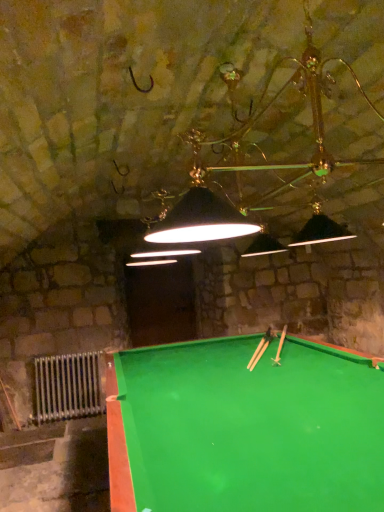
Identify the location of green felt billiard table at center. (245, 429).

The width and height of the screenshot is (384, 512). What do you see at coordinates (280, 346) in the screenshot? I see `green plastic cue at center, which ranks as the 1th cue in top-to-bottom order` at bounding box center [280, 346].

At what (x,y) coordinates should I click in order to perform the action: click on wooden cue at center, the second cue positioned from the top. Please return your answer as a coordinate pair (x, y). The height and width of the screenshot is (512, 384). Looking at the image, I should click on (260, 353).

From the image's perspective, between wooden cue at center, the second cue positioned from the top, and green felt billiard table at center, who is located below?

green felt billiard table at center is shown below in the image.

In the scene shown: Is wooden cue at center, the second cue positioned from the top, not near green felt billiard table at center?

wooden cue at center, the second cue positioned from the top, is near green felt billiard table at center, not far away.

Is wooden cue at center, the second cue positioned from the top, at the right side of green felt billiard table at center?

Indeed, wooden cue at center, the second cue positioned from the top, is positioned on the right side of green felt billiard table at center.

Find the location of a particular element. radiator below the green felt billiard table at center (from the image's perspective) is located at coordinates (68, 387).

Between silver metallic radiator at lower left and green felt billiard table at center, which one has smaller size?

Smaller between the two is silver metallic radiator at lower left.

Can you confirm if silver metallic radiator at lower left is wider than green felt billiard table at center?

In fact, silver metallic radiator at lower left might be narrower than green felt billiard table at center.

Is silver metallic radiator at lower left to the left or to the right of green felt billiard table at center in the image?

In the image, silver metallic radiator at lower left appears on the left side of green felt billiard table at center.

Are wooden cue at center, the second cue positioned from the top, and silver metallic radiator at lower left making contact?

They are not placed beside each other.

Is wooden cue at center, the second cue positioned from the top, turned away from silver metallic radiator at lower left?

No, wooden cue at center, the second cue positioned from the top,'s orientation is not away from silver metallic radiator at lower left.

From the image's perspective, is wooden cue at center, positioned as the first cue in bottom-to-top order, located beneath silver metallic radiator at lower left?

Actually, wooden cue at center, positioned as the first cue in bottom-to-top order, appears above silver metallic radiator at lower left in the image.

Which point is more distant from viewer, [251,367] or [61,370]?

The point [61,370] is farther from the camera.

From the image's perspective, which one is positioned lower, green plastic cue at center, which is counted as the 2th cue, starting from the bottom, or wooden cue at center, positioned as the first cue in bottom-to-top order?

wooden cue at center, positioned as the first cue in bottom-to-top order, from the image's perspective.

In terms of height, does green plastic cue at center, which ranks as the 1th cue in top-to-bottom order, look taller or shorter compared to wooden cue at center, positioned as the first cue in bottom-to-top order?

Considering their sizes, green plastic cue at center, which ranks as the 1th cue in top-to-bottom order, has more height than wooden cue at center, positioned as the first cue in bottom-to-top order.

Which object is positioned more to the left, green plastic cue at center, which ranks as the 1th cue in top-to-bottom order, or wooden cue at center, the second cue positioned from the top?

From the viewer's perspective, wooden cue at center, the second cue positioned from the top, appears more on the left side.

Can you confirm if green plastic cue at center, which ranks as the 1th cue in top-to-bottom order, is wider than green felt billiard table at center?

No.

Does green plastic cue at center, which is counted as the 2th cue, starting from the bottom, have a smaller size compared to green felt billiard table at center?

Yes, green plastic cue at center, which is counted as the 2th cue, starting from the bottom, is smaller than green felt billiard table at center.

Which is closer, (280, 349) or (204, 373)?

The point (204, 373) is closer.

From the image's perspective, does green plastic cue at center, which ranks as the 1th cue in top-to-bottom order, appear lower than green felt billiard table at center?

No, from the image's perspective, green plastic cue at center, which ranks as the 1th cue in top-to-bottom order, is not below green felt billiard table at center.

Considering the relative sizes of wooden cue at center, positioned as the first cue in bottom-to-top order, and green plastic cue at center, which is counted as the 2th cue, starting from the bottom, in the image provided, is wooden cue at center, positioned as the first cue in bottom-to-top order, smaller than green plastic cue at center, which is counted as the 2th cue, starting from the bottom,?

Correct, wooden cue at center, positioned as the first cue in bottom-to-top order, occupies less space than green plastic cue at center, which is counted as the 2th cue, starting from the bottom.

From the image's perspective, which one is positioned lower, wooden cue at center, positioned as the first cue in bottom-to-top order, or green plastic cue at center, which is counted as the 2th cue, starting from the bottom?

wooden cue at center, positioned as the first cue in bottom-to-top order.

Could you measure the distance between wooden cue at center, the second cue positioned from the top, and green plastic cue at center, which is counted as the 2th cue, starting from the bottom?

wooden cue at center, the second cue positioned from the top, and green plastic cue at center, which is counted as the 2th cue, starting from the bottom, are 6.86 inches apart.

Is wooden cue at center, positioned as the first cue in bottom-to-top order, in contact with green plastic cue at center, which is counted as the 2th cue, starting from the bottom?

No.

Is green felt billiard table at center further to camera compared to silver metallic radiator at lower left?

That is False.

Is green felt billiard table at center spatially inside silver metallic radiator at lower left, or outside of it?

green felt billiard table at center is spatially situated outside silver metallic radiator at lower left.

Is green felt billiard table at center taller or shorter than silver metallic radiator at lower left?

In the image, green felt billiard table at center appears to be taller than silver metallic radiator at lower left.

From a real-world perspective, who is located higher, green felt billiard table at center or silver metallic radiator at lower left?

From a 3D spatial view, green felt billiard table at center is above.

In order to click on billiard table on the left of wooden cue at center, positioned as the first cue in bottom-to-top order in this screenshot , I will do `click(245, 429)`.

Identify the location of billiard table above the silver metallic radiator at lower left (from a real-world perspective). (245, 429).

From the image, which object appears to be nearer to green felt billiard table at center, silver metallic radiator at lower left or green plastic cue at center, which is counted as the 2th cue, starting from the bottom?

green plastic cue at center, which is counted as the 2th cue, starting from the bottom, is positioned closer to the anchor green felt billiard table at center.

Considering their positions, is silver metallic radiator at lower left positioned closer to green plastic cue at center, which is counted as the 2th cue, starting from the bottom, than green felt billiard table at center?

Among the two, green felt billiard table at center is located nearer to green plastic cue at center, which is counted as the 2th cue, starting from the bottom.

Estimate the real-world distances between objects in this image. Which object is further from silver metallic radiator at lower left, wooden cue at center, positioned as the first cue in bottom-to-top order, or green felt billiard table at center?

Among the two, green felt billiard table at center is located further to silver metallic radiator at lower left.

Which object lies further to the anchor point green plastic cue at center, which ranks as the 1th cue in top-to-bottom order, green felt billiard table at center or wooden cue at center, the second cue positioned from the top?

green felt billiard table at center is positioned further to the anchor green plastic cue at center, which ranks as the 1th cue in top-to-bottom order.

When comparing their distances from silver metallic radiator at lower left, does green felt billiard table at center or wooden cue at center, the second cue positioned from the top, seem closer?

Based on the image, wooden cue at center, the second cue positioned from the top, appears to be nearer to silver metallic radiator at lower left.

Estimate the real-world distances between objects in this image. Which object is closer to wooden cue at center, the second cue positioned from the top, silver metallic radiator at lower left or green plastic cue at center, which is counted as the 2th cue, starting from the bottom?

green plastic cue at center, which is counted as the 2th cue, starting from the bottom.

Considering their positions, is green felt billiard table at center positioned closer to wooden cue at center, positioned as the first cue in bottom-to-top order, than green plastic cue at center, which ranks as the 1th cue in top-to-bottom order?

green plastic cue at center, which ranks as the 1th cue in top-to-bottom order, is closer to wooden cue at center, positioned as the first cue in bottom-to-top order.

Considering their positions, is wooden cue at center, positioned as the first cue in bottom-to-top order, positioned further to green felt billiard table at center than green plastic cue at center, which is counted as the 2th cue, starting from the bottom?

Among the two, green plastic cue at center, which is counted as the 2th cue, starting from the bottom, is located further to green felt billiard table at center.

Find the location of a particular element. Image resolution: width=384 pixels, height=512 pixels. cue located between green felt billiard table at center and green plastic cue at center, which is counted as the 2th cue, starting from the bottom, in the depth direction is located at coordinates (260, 353).

This screenshot has width=384, height=512. I want to click on cue between silver metallic radiator at lower left and green plastic cue at center, which ranks as the 1th cue in top-to-bottom order, from left to right, so click(260, 353).